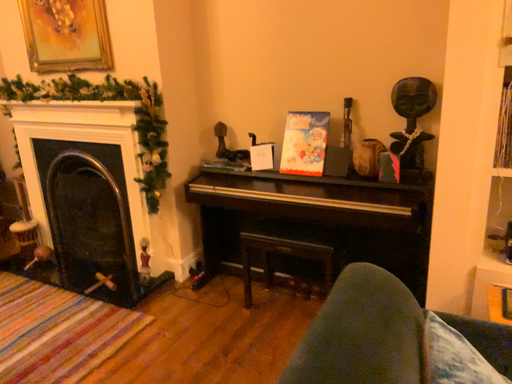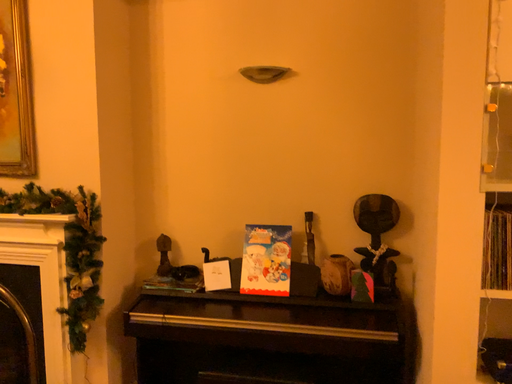
Question: How did the camera likely rotate when shooting the video?

Choices:
 (A) rotated left
 (B) rotated right

Answer: (B)